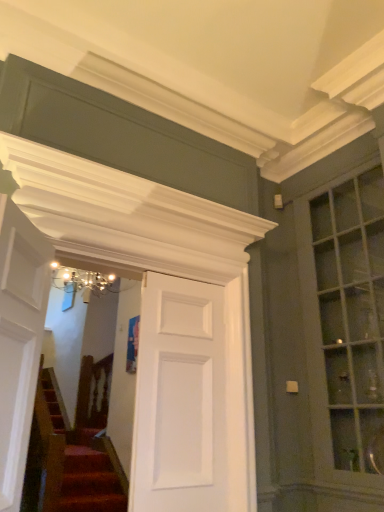
Question: From a real-world perspective, is matte glass window at right below white glossy door at left, which ranks as the 1th door in front-to-back order?

Choices:
 (A) no
 (B) yes

Answer: (A)

Question: Does matte glass window at right have a larger size compared to white glossy door at left, which ranks as the 1th door in front-to-back order?

Choices:
 (A) no
 (B) yes

Answer: (B)

Question: Can you confirm if matte glass window at right is positioned to the right of white glossy door at left, the 2th door from the right?

Choices:
 (A) no
 (B) yes

Answer: (B)

Question: Is matte glass window at right touching white glossy door at left, the second door viewed from the back?

Choices:
 (A) yes
 (B) no

Answer: (B)

Question: Is matte glass window at right far away from white glossy door at left, which ranks as the 1th door in front-to-back order?

Choices:
 (A) no
 (B) yes

Answer: (B)

Question: Is the depth of matte glass window at right less than that of white glossy door at left, which ranks as the 1th door in front-to-back order?

Choices:
 (A) no
 (B) yes

Answer: (A)

Question: Does white glossy door at left, which ranks as the 1th door in front-to-back order, have a smaller size compared to matte glass window at right?

Choices:
 (A) yes
 (B) no

Answer: (A)

Question: Is the depth of white glossy door at left, the second door viewed from the back, greater than that of matte glass window at right?

Choices:
 (A) no
 (B) yes

Answer: (A)

Question: Considering the relative sizes of white glossy door at left, the 2th door from the right, and matte glass window at right in the image provided, is white glossy door at left, the 2th door from the right, thinner than matte glass window at right?

Choices:
 (A) no
 (B) yes

Answer: (B)

Question: Is white glossy door at left, positioned as the first door in left-to-right order, positioned before matte glass window at right?

Choices:
 (A) yes
 (B) no

Answer: (A)

Question: Is white glossy door at left, the 2th door from the right, oriented away from matte glass window at right?

Choices:
 (A) no
 (B) yes

Answer: (A)

Question: Is white glossy door at left, which ranks as the 1th door in front-to-back order, facing towards matte glass window at right?

Choices:
 (A) yes
 (B) no

Answer: (B)

Question: From a real-world perspective, does matte glass window at right stand above white matte door at center, placed as the 2th door when sorted from front to back?

Choices:
 (A) yes
 (B) no

Answer: (A)